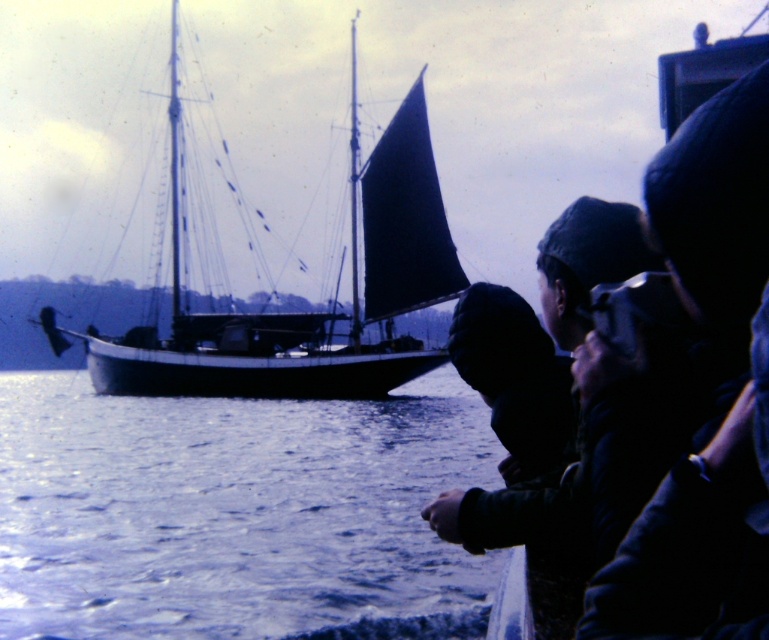
You are a photographer standing on the dock and want to capture a photo of the blue water at lower left and the dark blue canvas sailboat at left. Which object should you focus on first if you want to ensure both are in sharp focus?

The blue water at lower left is in front of the dark blue canvas sailboat at left, so you should focus on the blue water at lower left first to ensure both are in sharp focus.

You are a photographer standing on the dock. You want to take a photo of the blue water at lower left and the dark blue canvas sailboat at left. If your camera can focus on objects within 10 meters, will both subjects be in focus?

The blue water at lower left is 10.95 meters from the dark blue canvas sailboat at left. Since the camera can focus within 10 meters, the distance between them exceeds the focus range, so both subjects may not be in focus simultaneously.